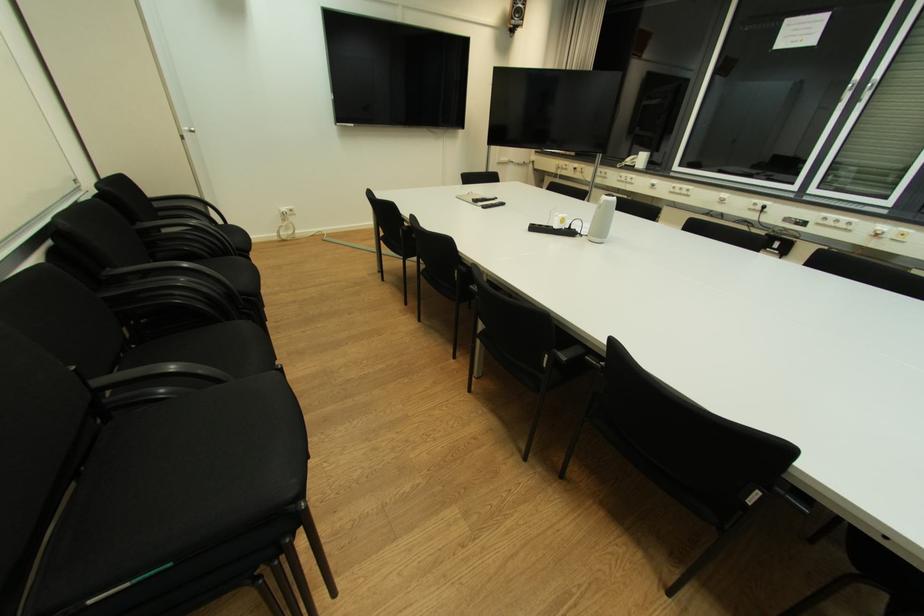
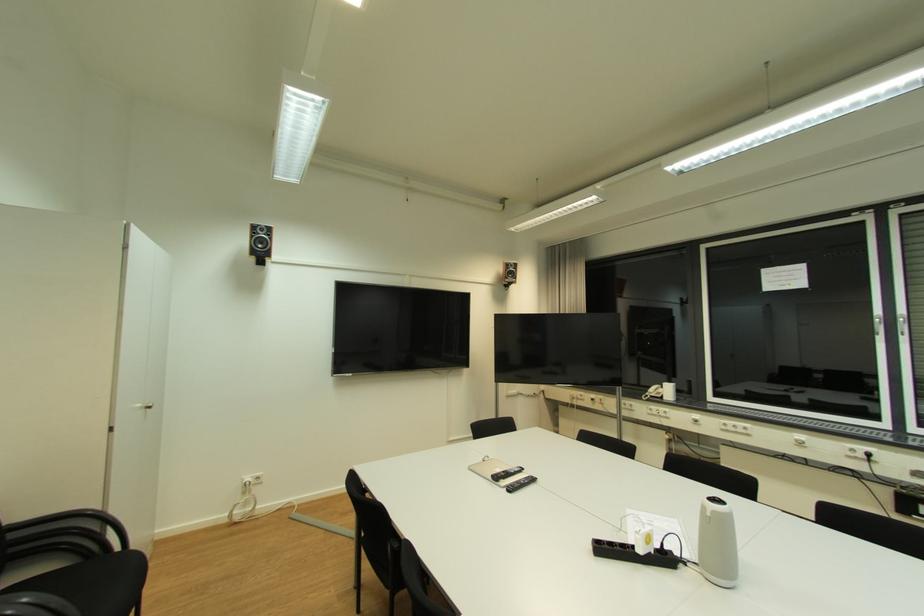
Where in the second image is the point corresponding to (x=227, y=225) from the first image?

(122, 554)